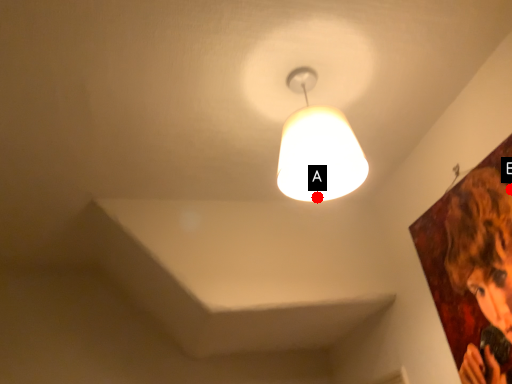
Question: Two points are circled on the image, labeled by A and B beside each circle. Which point is farther from the camera taking this photo?

Choices:
 (A) A is further
 (B) B is further

Answer: (A)